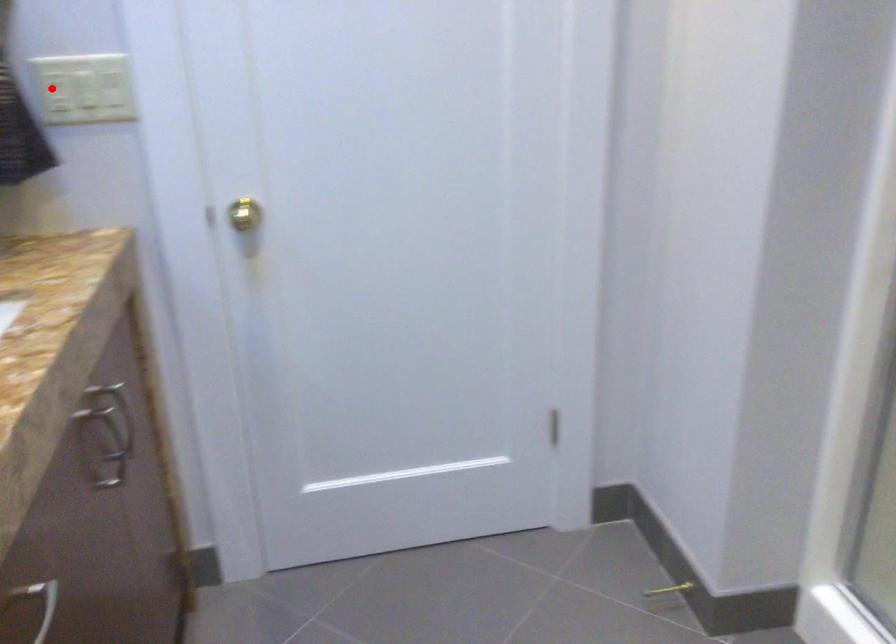
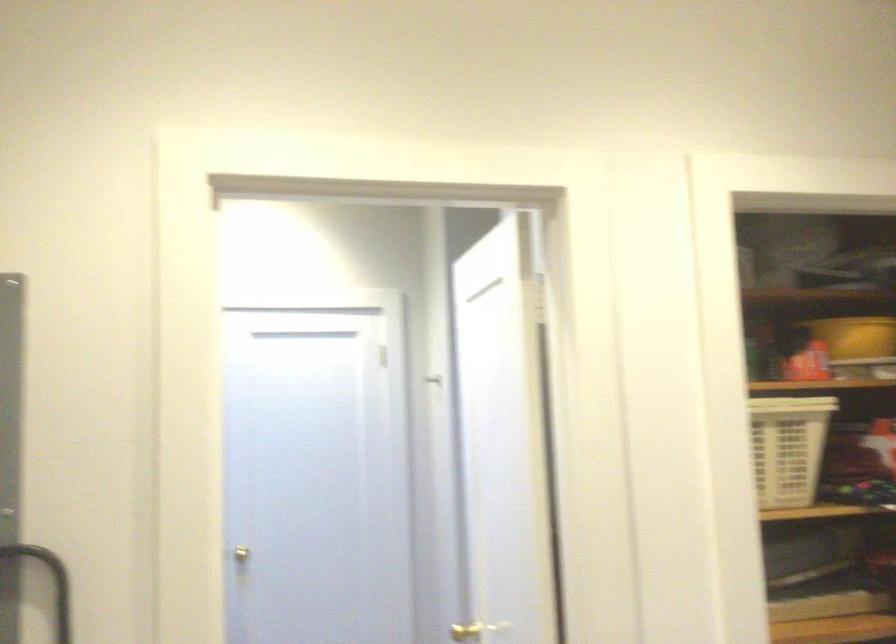
Question: I am providing you with two images of the same scene from different viewpoints. A red point is marked on the first image. Can you still see the location of the red point in image 2?

Choices:
 (A) Yes
 (B) No

Answer: (B)